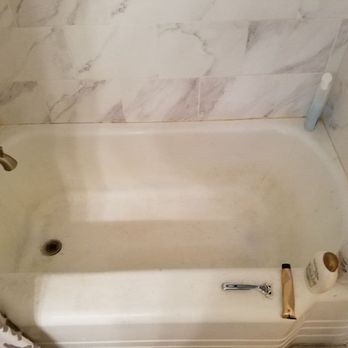
Where is `bathroom tub hole`? bathroom tub hole is located at coordinates (50, 248).